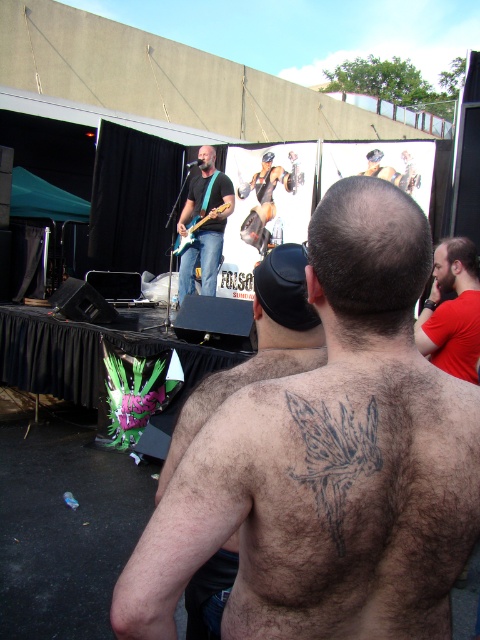
Does point (276, 586) come farther from viewer compared to point (383, 170)?

That is False.

Does hairy skin tattoo at center have a lesser width compared to smooth black tank top at upper center?

No.

Measure the distance between point (367, 586) and camera.

37.28 inches

The width and height of the screenshot is (480, 640). Find the location of `hairy skin tattoo at center`. hairy skin tattoo at center is located at coordinates (328, 461).

Is hairy skin tattoo at back bigger than matte blue jeans at center?

Actually, hairy skin tattoo at back might be smaller than matte blue jeans at center.

Which of these two, hairy skin tattoo at back or matte blue jeans at center, stands shorter?

hairy skin tattoo at back is shorter.

Does point (315, 321) come closer to viewer compared to point (213, 170)?

Yes, it is in front of point (213, 170).

Find the location of `hairy skin tattoo at back`. hairy skin tattoo at back is located at coordinates (259, 346).

Locate an element on the screen. This screenshot has height=640, width=480. black ink tattoo at back is located at coordinates click(x=335, y=456).

Looking at this image, is the position of black ink tattoo at back more distant than that of smooth black tank top at upper center?

No.

Where is `black ink tattoo at back`? This screenshot has height=640, width=480. black ink tattoo at back is located at coordinates (335, 456).